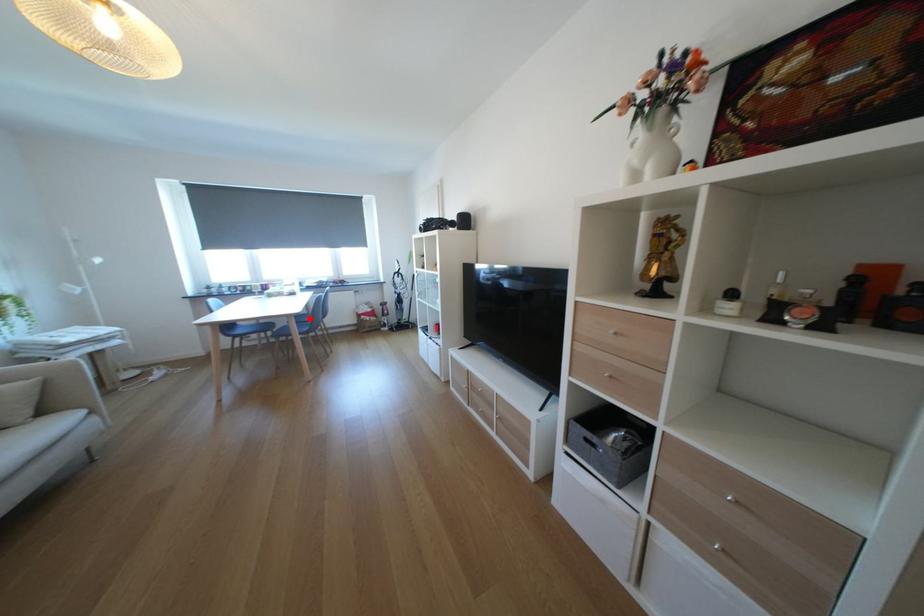
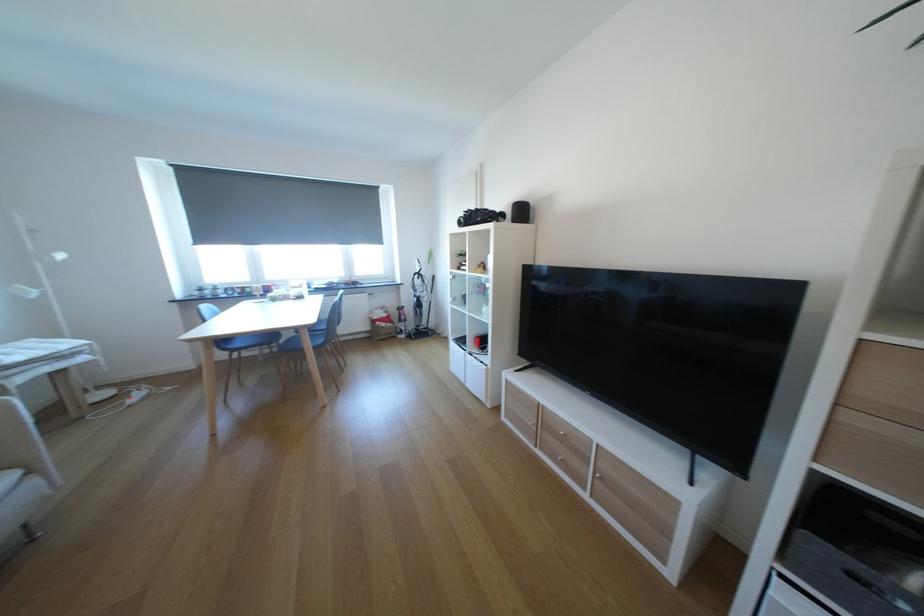
The point at the highlighted location is marked in the first image. Where is the corresponding point in the second image?

(322, 330)